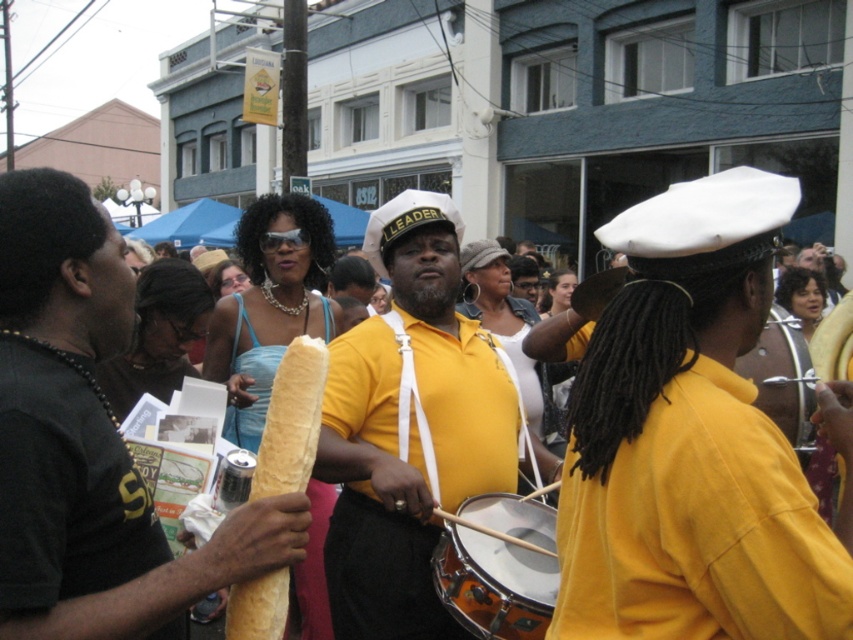
You are standing at the point with coordinates (689, 440) in the image. What object are you currently standing on?

You are standing on the yellow matte satin shirt at center.